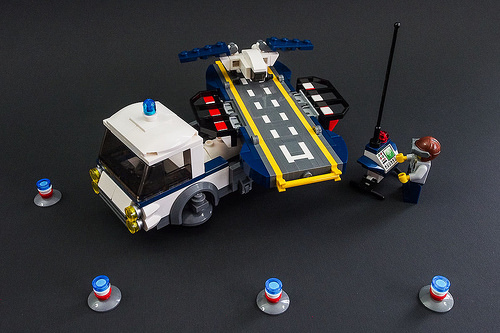
The width and height of the screenshot is (500, 333). Find the location of `computer`. computer is located at coordinates (387, 153).